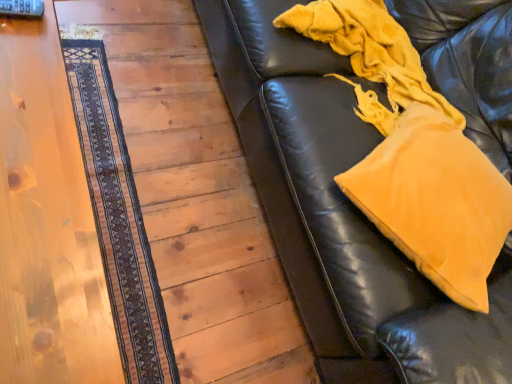
Question: Can you confirm if dark brown woven mat at left is taller than wooden table at left?

Choices:
 (A) no
 (B) yes

Answer: (A)

Question: Is dark brown woven mat at left facing towards wooden table at left?

Choices:
 (A) no
 (B) yes

Answer: (A)

Question: Does dark brown woven mat at left appear on the left side of wooden table at left?

Choices:
 (A) no
 (B) yes

Answer: (A)

Question: Considering the relative positions of dark brown woven mat at left and wooden table at left in the image provided, is dark brown woven mat at left in front of wooden table at left?

Choices:
 (A) no
 (B) yes

Answer: (A)

Question: From the image's perspective, is dark brown woven mat at left located above wooden table at left?

Choices:
 (A) yes
 (B) no

Answer: (A)

Question: Is dark brown woven mat at left wider than wooden table at left?

Choices:
 (A) yes
 (B) no

Answer: (B)

Question: Does wooden floor at lower left come in front of dark brown woven mat at left?

Choices:
 (A) yes
 (B) no

Answer: (A)

Question: Is wooden floor at lower left to the left of dark brown woven mat at left from the viewer's perspective?

Choices:
 (A) no
 (B) yes

Answer: (A)

Question: Does wooden floor at lower left come behind dark brown woven mat at left?

Choices:
 (A) yes
 (B) no

Answer: (B)

Question: From a real-world perspective, does wooden floor at lower left sit lower than dark brown woven mat at left?

Choices:
 (A) no
 (B) yes

Answer: (B)

Question: Does wooden floor at lower left have a lesser height compared to dark brown woven mat at left?

Choices:
 (A) no
 (B) yes

Answer: (A)

Question: Does wooden floor at lower left touch dark brown woven mat at left?

Choices:
 (A) yes
 (B) no

Answer: (B)

Question: From a real-world perspective, is wooden floor at lower left positioned over velvety yellow blanket at right based on gravity?

Choices:
 (A) no
 (B) yes

Answer: (A)